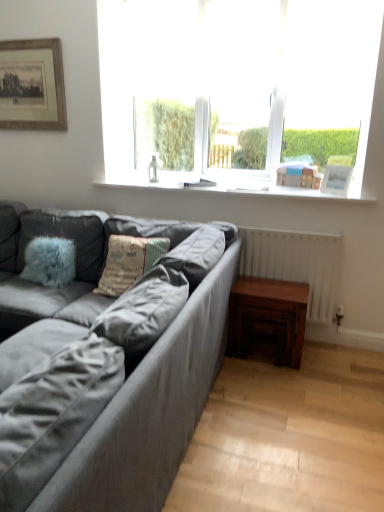
Question: From a real-world perspective, is textured fabric pillow at center physically located above or below wooden framed print at upper left, which is counted as the 1th picture frame, starting from the top?

Choices:
 (A) above
 (B) below

Answer: (B)

Question: Do you think textured fabric pillow at center is within wooden framed print at upper left, the 1th picture frame positioned from the left, or outside of it?

Choices:
 (A) outside
 (B) inside

Answer: (A)

Question: Which object is the farthest from the suede gray couch at left?

Choices:
 (A) white plastic window sill at upper center
 (B) transparent glass window at upper center
 (C) white glossy picture frame at upper right, placed as the second picture frame when sorted from top to bottom
 (D) textured fabric pillow at center
 (E) dark brown wooden table at lower right

Answer: (C)

Question: Which of these objects is positioned farthest from the white plastic window sill at upper center?

Choices:
 (A) transparent glass window at upper center
 (B) dark brown wooden table at lower right
 (C) textured fabric pillow at center
 (D) suede gray couch at left
 (E) wooden framed print at upper left, arranged as the second picture frame when ordered from the bottom

Answer: (D)